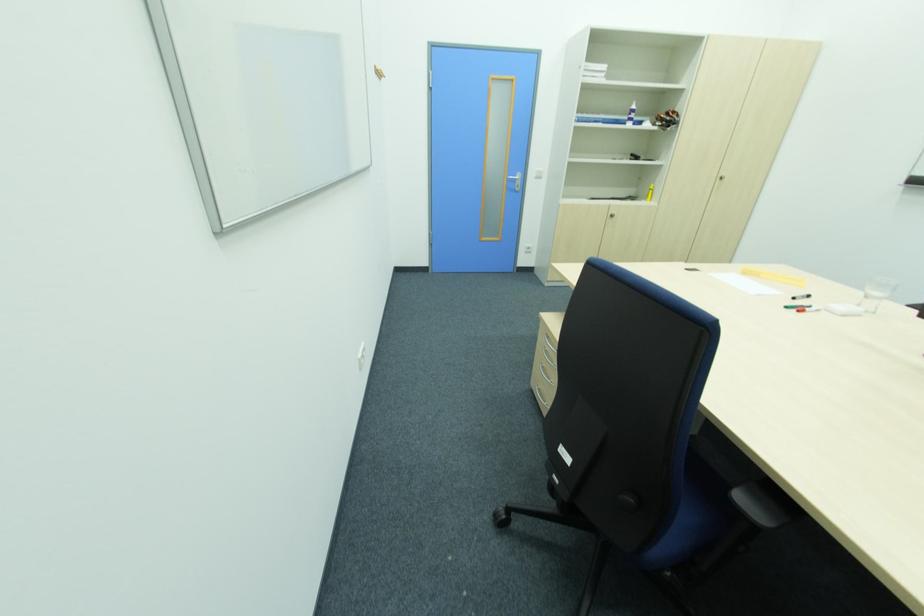
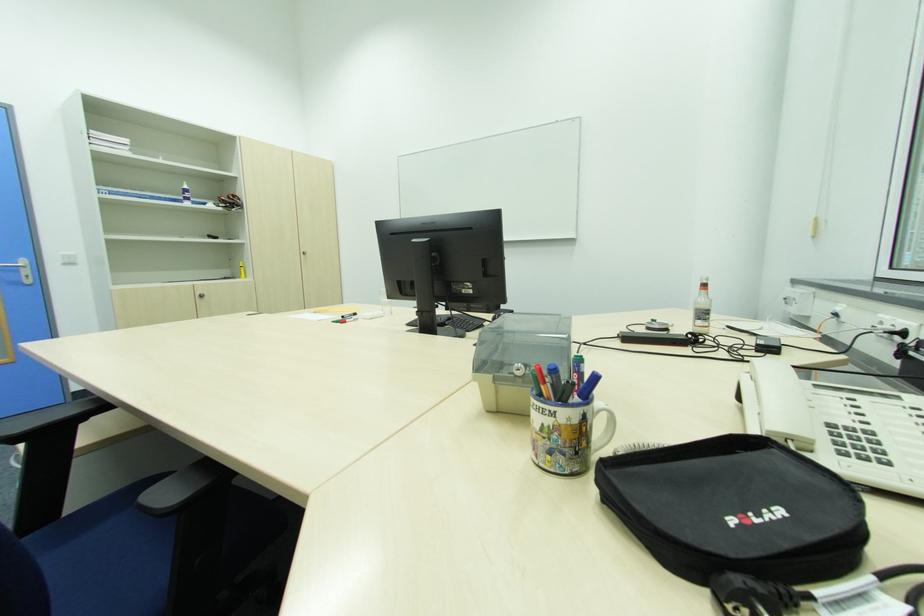
In the second image, find the point that corresponds to the point at 520,190 in the first image.

(30, 282)